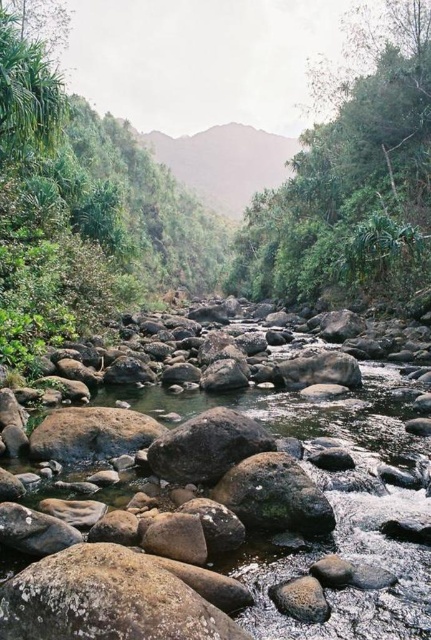
You are a bird looking for a nesting spot. You see the green leafy tree at upper right and the green leafy tree at upper left. Which tree would provide a higher nesting position?

The green leafy tree at upper right is much taller than the green leafy tree at upper left, so it would provide a higher nesting position.

You are standing in the middle of the river looking upstream. Which direction should you turn to face the green leafy tree at upper right first before the green leafy tree at upper left?

You should turn to your right because the green leafy tree at upper right is located to the right of the green leafy tree at upper left.